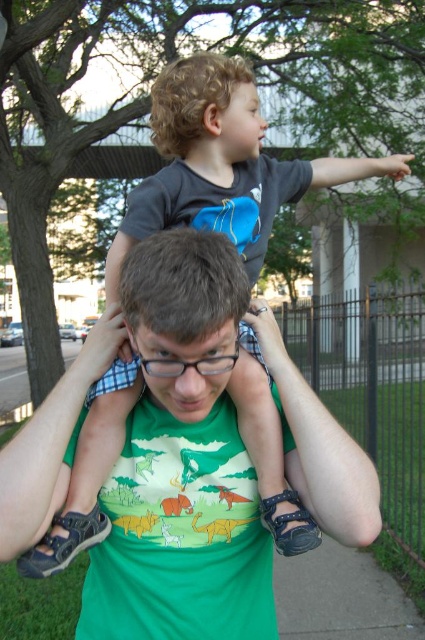
Does green matte shirt at center have a larger size compared to curly blonde hair at upper center?

No.

Between point (167, 232) and point (192, 54), which one is positioned in front?

Positioned in front is point (167, 232).

Is point (186, 276) closer to viewer compared to point (204, 54)?

Yes, it is in front of point (204, 54).

You are a GUI agent. You are given a task and a screenshot of the screen. Output one action in this format:
    pyautogui.click(x=<x>, y=<y>)
    Task: Click on the green matte shirt at center
    This screenshot has width=425, height=640.
    Given the screenshot: What is the action you would take?
    pyautogui.click(x=184, y=312)